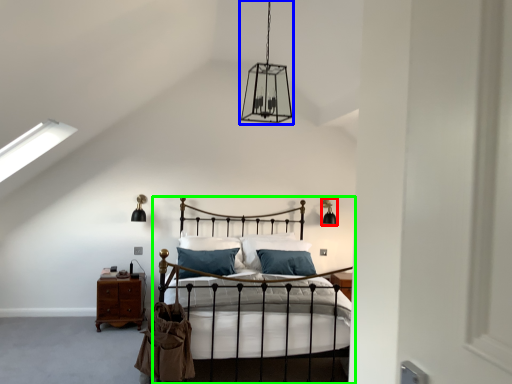
Question: Which is farther away from light fixture (highlighted by a red box)? light fixture (highlighted by a blue box) or bed (highlighted by a green box)?

Choices:
 (A) light fixture
 (B) bed

Answer: (A)